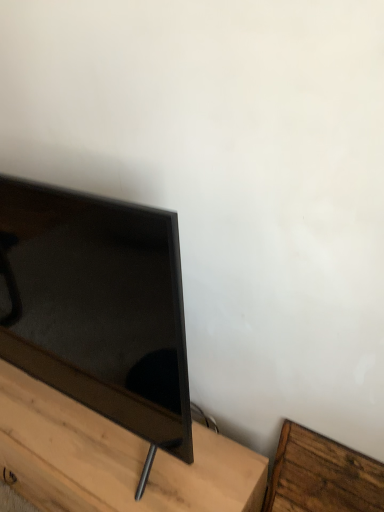
Question: Is matte black tv at left positioned with its back to wooden bed frame at lower right, which is the 1th furniture from right to left?

Choices:
 (A) yes
 (B) no

Answer: (B)

Question: From a real-world perspective, is matte black tv at left located higher than wooden bed frame at lower right, arranged as the second furniture when viewed from the left?

Choices:
 (A) yes
 (B) no

Answer: (A)

Question: Considering the relative positions of matte black tv at left and wooden bed frame at lower right, arranged as the second furniture when viewed from the left, in the image provided, is matte black tv at left to the right of wooden bed frame at lower right, arranged as the second furniture when viewed from the left, from the viewer's perspective?

Choices:
 (A) yes
 (B) no

Answer: (B)

Question: Is matte black tv at left further to the viewer compared to wooden bed frame at lower right, which is the 1th furniture from right to left?

Choices:
 (A) no
 (B) yes

Answer: (A)

Question: Can you confirm if matte black tv at left is positioned to the left of wooden bed frame at lower right, arranged as the second furniture when viewed from the left?

Choices:
 (A) yes
 (B) no

Answer: (A)

Question: Is wooden bed frame at lower right, which is the 1th furniture from right to left, located within matte black tv at left?

Choices:
 (A) yes
 (B) no

Answer: (B)

Question: Is matte black tv stand at lower left, acting as the first furniture starting from the left, directly adjacent to wooden bed frame at lower right, which is the 1th furniture from right to left?

Choices:
 (A) yes
 (B) no

Answer: (B)

Question: Is matte black tv stand at lower left, the 2th furniture in the right-to-left sequence, not near wooden bed frame at lower right, arranged as the second furniture when viewed from the left?

Choices:
 (A) no
 (B) yes

Answer: (A)

Question: Does matte black tv stand at lower left, acting as the first furniture starting from the left, appear on the right side of wooden bed frame at lower right, arranged as the second furniture when viewed from the left?

Choices:
 (A) yes
 (B) no

Answer: (B)

Question: Is matte black tv stand at lower left, acting as the first furniture starting from the left, bigger than wooden bed frame at lower right, arranged as the second furniture when viewed from the left?

Choices:
 (A) yes
 (B) no

Answer: (A)

Question: Is matte black tv stand at lower left, the 2th furniture in the right-to-left sequence, outside wooden bed frame at lower right, which is the 1th furniture from right to left?

Choices:
 (A) no
 (B) yes

Answer: (B)

Question: Does matte black tv stand at lower left, acting as the first furniture starting from the left, have a lesser width compared to wooden bed frame at lower right, arranged as the second furniture when viewed from the left?

Choices:
 (A) yes
 (B) no

Answer: (B)

Question: Considering the relative sizes of wooden bed frame at lower right, which is the 1th furniture from right to left, and matte black tv at left in the image provided, is wooden bed frame at lower right, which is the 1th furniture from right to left, thinner than matte black tv at left?

Choices:
 (A) yes
 (B) no

Answer: (A)